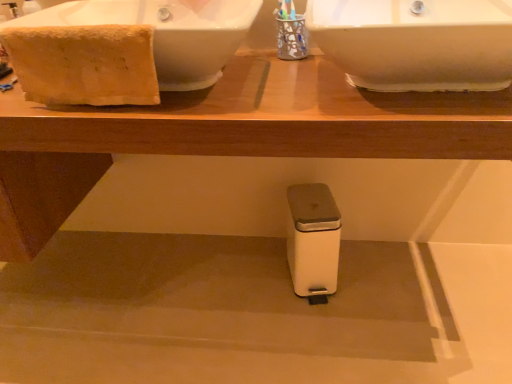
Question: Considering their positions, is beige cotton towel at upper left located in front of or behind white glossy sink at upper left, which is counted as the first sink, starting from the left?

Choices:
 (A) behind
 (B) front

Answer: (A)

Question: Do you think beige cotton towel at upper left is within white glossy sink at upper left, which ranks as the 2th sink in right-to-left order, or outside of it?

Choices:
 (A) inside
 (B) outside

Answer: (A)

Question: Estimate the real-world distances between objects in this image. Which object is closer to the white glossy sink at upper right, the 2th sink from the left?

Choices:
 (A) white plastic table at center
 (B) beige cotton towel at upper left
 (C) white glossy sink at upper left, which is counted as the first sink, starting from the left

Answer: (A)

Question: Which is farther from the white glossy sink at upper left, which ranks as the 2th sink in right-to-left order?

Choices:
 (A) beige cotton towel at upper left
 (B) white plastic table at center
 (C) white glossy sink at upper right, acting as the first sink starting from the right

Answer: (C)